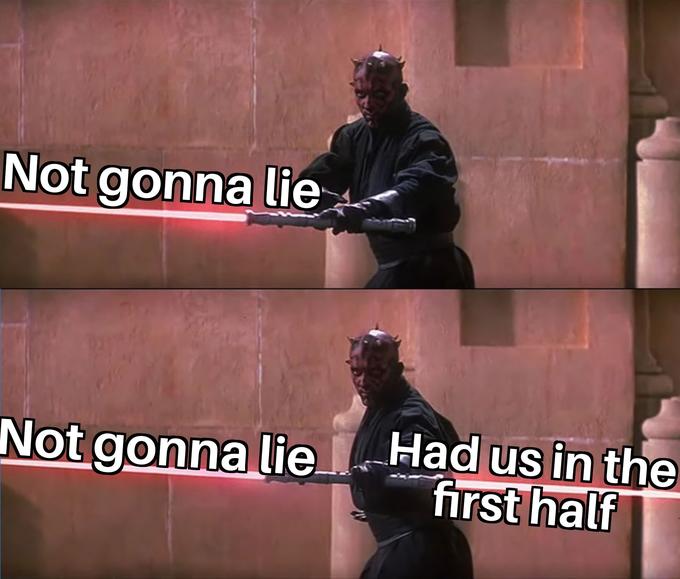
What are the coordinates of `bottom panel` in the screenshot? It's located at (511, 372).